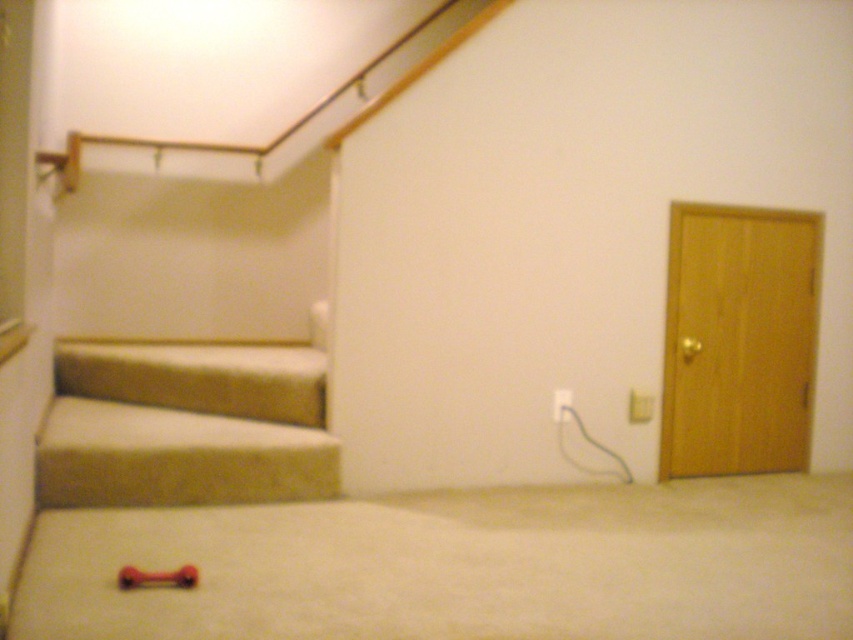
Question: Which point is farther to the camera?

Choices:
 (A) white plastic electric outlet at center-right
 (B) white plastic electric outlet at lower right
 (C) beige carpeted stairs at lower left
 (D) rubberized red dumbbell at lower center

Answer: (B)

Question: Estimate the real-world distances between objects in this image. Which object is farther from the beige carpeted stairs at lower left?

Choices:
 (A) white plastic electric outlet at center-right
 (B) white plastic electric outlet at lower right
 (C) rubberized red dumbbell at lower center

Answer: (B)

Question: Which point is farther to the camera?

Choices:
 (A) (630, 417)
 (B) (270, 390)
 (C) (563, 417)

Answer: (A)

Question: Is beige carpeted stairs at lower left above white plastic electric outlet at lower right?

Choices:
 (A) yes
 (B) no

Answer: (B)

Question: Where is beige carpeted stairs at lower left located in relation to white plastic electric outlet at lower right in the image?

Choices:
 (A) below
 (B) above

Answer: (A)

Question: Does beige carpeted stairs at lower left appear on the right side of white plastic electric outlet at lower right?

Choices:
 (A) no
 (B) yes

Answer: (A)